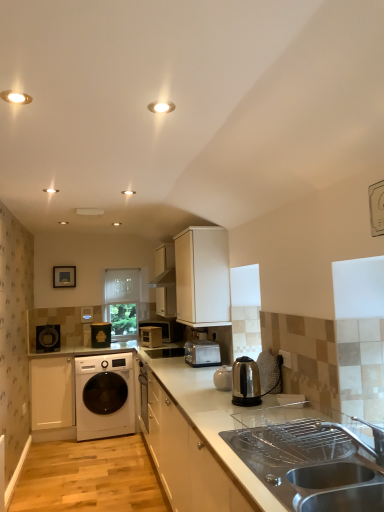
Question: In terms of size, does stainless steel kettle at center, placed as the 3th home appliance when sorted from left to right, appear bigger or smaller than metallic silver microwave at center, positioned as the first appliance in right-to-left order?

Choices:
 (A) small
 (B) big

Answer: (A)

Question: Is stainless steel kettle at center, placed as the 3th home appliance when sorted from left to right, taller or shorter than metallic silver microwave at center, positioned as the first appliance in right-to-left order?

Choices:
 (A) short
 (B) tall

Answer: (B)

Question: Based on their relative distances, which object is farther from the white matte cabinet at upper center, acting as the first cabinetry starting from the top?

Choices:
 (A) stainless steel sink at lower right
 (B) white glossy washing machine at lower left
 (C) stainless steel kettle at center, marked as the first home appliance in a right-to-left arrangement
 (D) metallic silver toaster at center, the 2th appliance positioned from the right
 (E) white glossy light fixture at upper left, the 1th lighting in the left-to-right sequence

Answer: (D)

Question: Which of these objects is positioned farthest from the white glossy light fixture at upper left, the second lighting when ordered from right to left?

Choices:
 (A) white glossy countertop at center
 (B) stainless steel sink at lower right
 (C) metallic silver toaster at center, marked as the 1th appliance in a left-to-right arrangement
 (D) white matte cabinet at upper center, the 2th cabinetry positioned from the left
 (E) white glossy washing machine at lower left

Answer: (C)